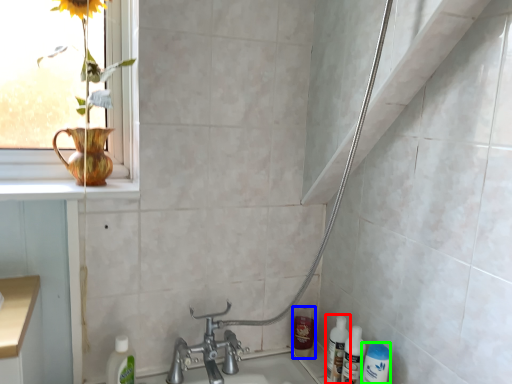
Question: Considering the real-world distances, which object is farthest from bottle (highlighted by a red box)? mouthwash (highlighted by a blue box) or mouthwash (highlighted by a green box)?

Choices:
 (A) mouthwash
 (B) mouthwash

Answer: (A)